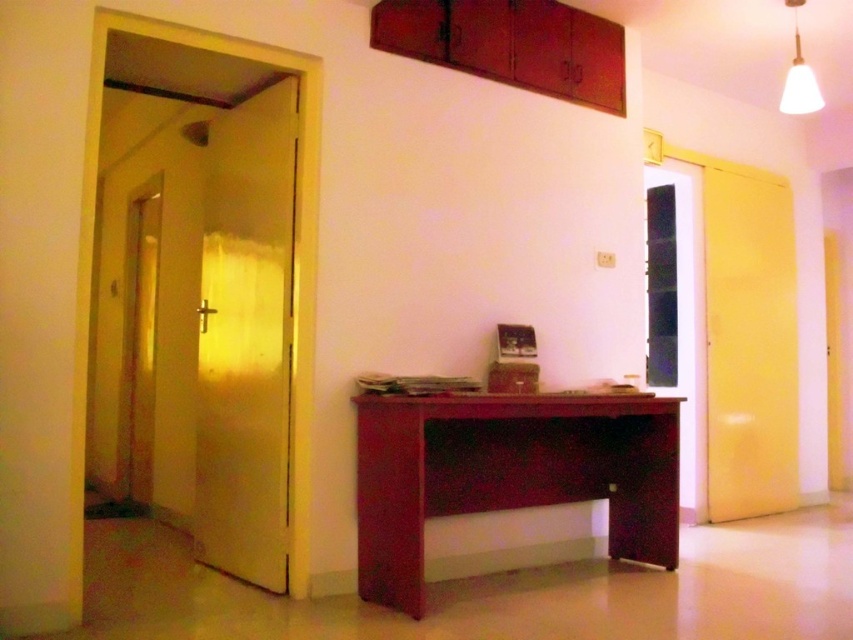
Does matte wood cabinet at upper center appear on the left side of white matte lampshade at upper right?

Yes, matte wood cabinet at upper center is to the left of white matte lampshade at upper right.

Who is more distant from viewer, (589, 26) or (809, 99)?

The point (589, 26) is more distant.

What do you see at coordinates (511, 44) in the screenshot? I see `matte wood cabinet at upper center` at bounding box center [511, 44].

This screenshot has height=640, width=853. In order to click on matte wood cabinet at upper center in this screenshot , I will do `click(511, 44)`.

The image size is (853, 640). Describe the element at coordinates (508, 472) in the screenshot. I see `satin wood desk at center` at that location.

Does point (645, 492) come behind point (575, 38)?

No, it is in front of (575, 38).

What are the coordinates of `satin wood desk at center` in the screenshot? It's located at (508, 472).

In order to click on satin wood desk at center in this screenshot , I will do `click(508, 472)`.

Is satin wood desk at center smaller than white matte lampshade at upper right?

No, satin wood desk at center is not smaller than white matte lampshade at upper right.

Is satin wood desk at center bigger than white matte lampshade at upper right?

Yes.

What do you see at coordinates (508, 472) in the screenshot?
I see `satin wood desk at center` at bounding box center [508, 472].

What are the coordinates of `satin wood desk at center` in the screenshot? It's located at (508, 472).